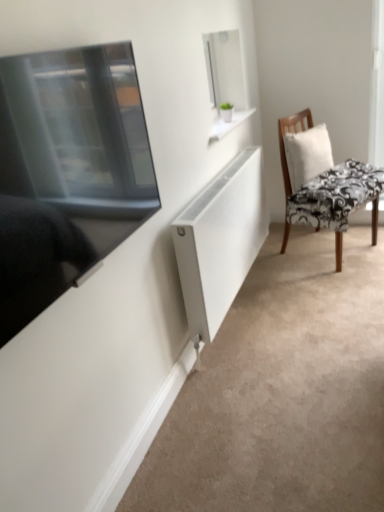
Question: Considering the relative sizes of black floral fabric chair at right and matte black tv at left in the image provided, is black floral fabric chair at right shorter than matte black tv at left?

Choices:
 (A) no
 (B) yes

Answer: (A)

Question: Is black floral fabric chair at right thinner than matte black tv at left?

Choices:
 (A) no
 (B) yes

Answer: (A)

Question: Does black floral fabric chair at right have a greater height compared to matte black tv at left?

Choices:
 (A) yes
 (B) no

Answer: (A)

Question: From the image's perspective, is black floral fabric chair at right located beneath matte black tv at left?

Choices:
 (A) yes
 (B) no

Answer: (B)

Question: Can you confirm if black floral fabric chair at right is positioned to the left of matte black tv at left?

Choices:
 (A) no
 (B) yes

Answer: (A)

Question: From the image's perspective, is white matte radiator at center positioned above or below matte black tv at left?

Choices:
 (A) above
 (B) below

Answer: (B)

Question: Is white matte radiator at center to the left or to the right of matte black tv at left in the image?

Choices:
 (A) right
 (B) left

Answer: (A)

Question: Considering the positions of point (241, 253) and point (120, 98), is point (241, 253) closer or farther from the camera than point (120, 98)?

Choices:
 (A) farther
 (B) closer

Answer: (A)

Question: From a real-world perspective, is white matte radiator at center above or below matte black tv at left?

Choices:
 (A) above
 (B) below

Answer: (B)

Question: Is white fabric pillow at right spatially inside white matte radiator at center, or outside of it?

Choices:
 (A) outside
 (B) inside

Answer: (A)

Question: Considering the positions of white fabric pillow at right and white matte radiator at center in the image, is white fabric pillow at right bigger or smaller than white matte radiator at center?

Choices:
 (A) small
 (B) big

Answer: (A)

Question: From a real-world perspective, is white fabric pillow at right positioned above or below white matte radiator at center?

Choices:
 (A) above
 (B) below

Answer: (A)

Question: Is white fabric pillow at right wider or thinner than white matte radiator at center?

Choices:
 (A) thin
 (B) wide

Answer: (A)

Question: Considering the positions of white fabric pillow at right and matte black tv at left in the image, is white fabric pillow at right wider or thinner than matte black tv at left?

Choices:
 (A) wide
 (B) thin

Answer: (A)

Question: Is white fabric pillow at right situated inside matte black tv at left or outside?

Choices:
 (A) inside
 (B) outside

Answer: (B)